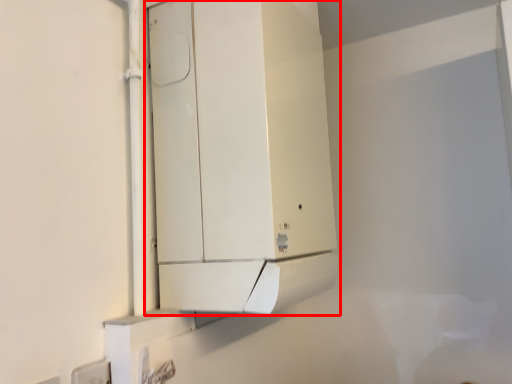
Question: From the image's perspective, what is the correct spatial relationship of cabinetry (annotated by the red box) in relation to electric outlet?

Choices:
 (A) above
 (B) below

Answer: (A)